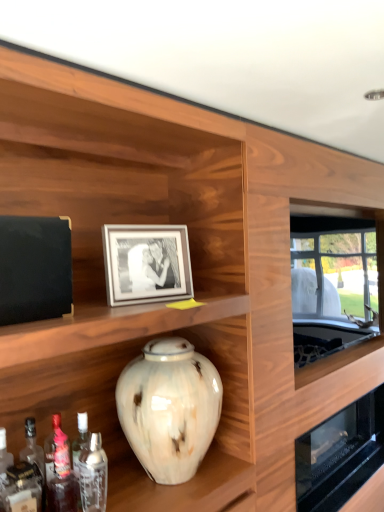
Image resolution: width=384 pixels, height=512 pixels. Describe the element at coordinates (93, 475) in the screenshot. I see `clear glass bottle at lower left, acting as the 1th bottle starting from the right` at that location.

What do you see at coordinates (146, 263) in the screenshot? I see `matte silver picture frame at center` at bounding box center [146, 263].

Where is `translucent glass bottle at lower left, which appears as the first bottle when viewed from the left`? The height and width of the screenshot is (512, 384). translucent glass bottle at lower left, which appears as the first bottle when viewed from the left is located at coordinates point(62,478).

Measure the distance between marbled ceramic vase at center and camera.

marbled ceramic vase at center and camera are 4.69 feet apart.

I want to click on clear glass bottle at lower left, acting as the 1th bottle starting from the right, so click(x=93, y=475).

Is marbled ceramic vase at center looking in the opposite direction of translucent glass bottle at lower left, marked as the second bottle in a right-to-left arrangement?

That's not correct — marbled ceramic vase at center is not looking away from translucent glass bottle at lower left, marked as the second bottle in a right-to-left arrangement.

Is marbled ceramic vase at center beside translucent glass bottle at lower left, which appears as the first bottle when viewed from the left?

No.

Is marbled ceramic vase at center inside the boundaries of translucent glass bottle at lower left, marked as the second bottle in a right-to-left arrangement, or outside?

marbled ceramic vase at center lies outside translucent glass bottle at lower left, marked as the second bottle in a right-to-left arrangement.

Can you confirm if marbled ceramic vase at center is positioned to the left of translucent glass bottle at lower left, marked as the second bottle in a right-to-left arrangement?

In fact, marbled ceramic vase at center is to the right of translucent glass bottle at lower left, marked as the second bottle in a right-to-left arrangement.

In order to click on vase that appears above the translucent glass bottle at lower left, which appears as the first bottle when viewed from the left (from a real-world perspective) in this screenshot , I will do `click(169, 408)`.

Is translucent glass bottle at lower left, marked as the second bottle in a right-to-left arrangement, in front of marbled ceramic vase at center?

Yes, translucent glass bottle at lower left, marked as the second bottle in a right-to-left arrangement, is closer to the viewer.

In terms of size, does translucent glass bottle at lower left, marked as the second bottle in a right-to-left arrangement, appear bigger or smaller than marbled ceramic vase at center?

Clearly, translucent glass bottle at lower left, marked as the second bottle in a right-to-left arrangement, is smaller in size than marbled ceramic vase at center.

Is marbled ceramic vase at center inside translucent glass bottle at lower left, which appears as the first bottle when viewed from the left?

Definitely not — marbled ceramic vase at center is not inside translucent glass bottle at lower left, which appears as the first bottle when viewed from the left.

From a real-world perspective, is matte silver picture frame at center physically below translucent glass bottle at lower left, marked as the second bottle in a right-to-left arrangement?

No, from a real-world perspective, matte silver picture frame at center is not under translucent glass bottle at lower left, marked as the second bottle in a right-to-left arrangement.

Is matte silver picture frame at center surrounding translucent glass bottle at lower left, marked as the second bottle in a right-to-left arrangement?

No.

Is matte silver picture frame at center oriented towards translucent glass bottle at lower left, which appears as the first bottle when viewed from the left?

No, matte silver picture frame at center is not turned towards translucent glass bottle at lower left, which appears as the first bottle when viewed from the left.

Considering the relative sizes of matte silver picture frame at center and translucent glass bottle at lower left, which appears as the first bottle when viewed from the left, in the image provided, is matte silver picture frame at center shorter than translucent glass bottle at lower left, which appears as the first bottle when viewed from the left,?

Indeed, matte silver picture frame at center has a lesser height compared to translucent glass bottle at lower left, which appears as the first bottle when viewed from the left.

Would you say clear glass bottle at lower left, the second bottle positioned from the left, is to the left or to the right of transparent glass window at right in the picture?

Clearly, clear glass bottle at lower left, the second bottle positioned from the left, is on the left of transparent glass window at right in the image.

Choose the correct answer: Is clear glass bottle at lower left, the second bottle positioned from the left, inside transparent glass window at right or outside it?

The correct answer is: outside.

From a real-world perspective, between clear glass bottle at lower left, the second bottle positioned from the left, and transparent glass window at right, who is vertically higher?

In real-world perspective, transparent glass window at right is above.

Is point (102, 504) in front of point (332, 284)?

Yes, point (102, 504) is in front of point (332, 284).

From a real-world perspective, is transparent glass window at right positioned over translucent glass bottle at lower left, which appears as the first bottle when viewed from the left, based on gravity?

Yes, from a real-world perspective, transparent glass window at right is on top of translucent glass bottle at lower left, which appears as the first bottle when viewed from the left.

Which is farther, [336,361] or [61,489]?

The point [336,361] is farther.

Is transparent glass window at right turned away from translucent glass bottle at lower left, marked as the second bottle in a right-to-left arrangement?

No, transparent glass window at right is not facing the opposite direction of translucent glass bottle at lower left, marked as the second bottle in a right-to-left arrangement.

Could you measure the distance between transparent glass window at right and translucent glass bottle at lower left, marked as the second bottle in a right-to-left arrangement?

transparent glass window at right is 1.56 meters away from translucent glass bottle at lower left, marked as the second bottle in a right-to-left arrangement.

Can you confirm if transparent glass window at right is bigger than marbled ceramic vase at center?

Yes.

What's the angular difference between transparent glass window at right and marbled ceramic vase at center's facing directions?

0.116 degrees.

Find the location of a particular element. window behind the marbled ceramic vase at center is located at coordinates (337, 294).

Consider the image. Can you confirm if clear glass bottle at lower left, acting as the 1th bottle starting from the right, is shorter than marbled ceramic vase at center?

Indeed, clear glass bottle at lower left, acting as the 1th bottle starting from the right, has a lesser height compared to marbled ceramic vase at center.

Is marbled ceramic vase at center completely or partially inside clear glass bottle at lower left, the second bottle positioned from the left?

No, marbled ceramic vase at center is not surrounded by clear glass bottle at lower left, the second bottle positioned from the left.

Is point (80, 476) positioned before point (147, 442)?

Yes, it is in front of point (147, 442).

From a real-world perspective, is clear glass bottle at lower left, acting as the 1th bottle starting from the right, on marbled ceramic vase at center?

No, from a real-world perspective, clear glass bottle at lower left, acting as the 1th bottle starting from the right, is not above marbled ceramic vase at center.

Starting from the marbled ceramic vase at center, which bottle is the 2nd one to the left? Please provide its 2D coordinates.

[(62, 478)]

Find the location of a particular element. The image size is (384, 512). vase that is above the translucent glass bottle at lower left, which appears as the first bottle when viewed from the left (from a real-world perspective) is located at coordinates [x=169, y=408].

Which object lies nearer to the anchor point matte silver picture frame at center, transparent glass window at right or clear glass bottle at lower left, acting as the 1th bottle starting from the right?

clear glass bottle at lower left, acting as the 1th bottle starting from the right.

Looking at the image, which one is located closer to translucent glass bottle at lower left, marked as the second bottle in a right-to-left arrangement, transparent glass window at right or matte silver picture frame at center?

The object closer to translucent glass bottle at lower left, marked as the second bottle in a right-to-left arrangement, is matte silver picture frame at center.

Considering their positions, is marbled ceramic vase at center positioned further to matte silver picture frame at center than transparent glass window at right?

transparent glass window at right.

From the image, which object appears to be farther from translucent glass bottle at lower left, which appears as the first bottle when viewed from the left, matte silver picture frame at center or clear glass bottle at lower left, acting as the 1th bottle starting from the right?

matte silver picture frame at center lies further to translucent glass bottle at lower left, which appears as the first bottle when viewed from the left, than the other object.

Considering their positions, is transparent glass window at right positioned further to translucent glass bottle at lower left, which appears as the first bottle when viewed from the left, than marbled ceramic vase at center?

Based on the image, transparent glass window at right appears to be further to translucent glass bottle at lower left, which appears as the first bottle when viewed from the left.

Considering their positions, is marbled ceramic vase at center positioned further to translucent glass bottle at lower left, which appears as the first bottle when viewed from the left, than clear glass bottle at lower left, the second bottle positioned from the left?

marbled ceramic vase at center.

When comparing their distances from matte silver picture frame at center, does translucent glass bottle at lower left, marked as the second bottle in a right-to-left arrangement, or marbled ceramic vase at center seem closer?

Based on the image, marbled ceramic vase at center appears to be nearer to matte silver picture frame at center.

Considering their positions, is clear glass bottle at lower left, acting as the 1th bottle starting from the right, positioned closer to translucent glass bottle at lower left, marked as the second bottle in a right-to-left arrangement, than marbled ceramic vase at center?

The object closer to translucent glass bottle at lower left, marked as the second bottle in a right-to-left arrangement, is clear glass bottle at lower left, acting as the 1th bottle starting from the right.

Where is `bottle situated between translucent glass bottle at lower left, marked as the second bottle in a right-to-left arrangement, and transparent glass window at right from left to right`? bottle situated between translucent glass bottle at lower left, marked as the second bottle in a right-to-left arrangement, and transparent glass window at right from left to right is located at coordinates (93, 475).

Locate an element on the screen. bottle that lies between matte silver picture frame at center and clear glass bottle at lower left, the second bottle positioned from the left, from top to bottom is located at coordinates (62, 478).

Identify the location of vase between matte silver picture frame at center and translucent glass bottle at lower left, marked as the second bottle in a right-to-left arrangement, from top to bottom. (169, 408).

Where is `picture frame situated between translucent glass bottle at lower left, marked as the second bottle in a right-to-left arrangement, and transparent glass window at right from left to right`? The image size is (384, 512). picture frame situated between translucent glass bottle at lower left, marked as the second bottle in a right-to-left arrangement, and transparent glass window at right from left to right is located at coordinates (146, 263).